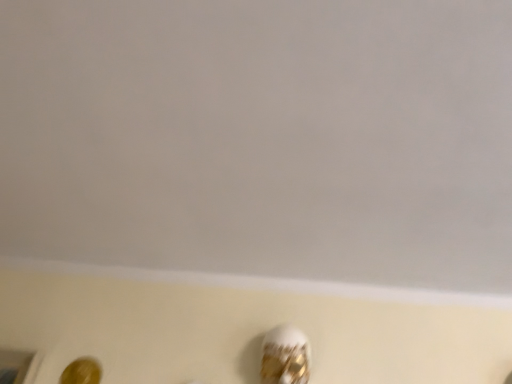
Where is `white glossy human face at lower center`? The height and width of the screenshot is (384, 512). white glossy human face at lower center is located at coordinates [x=284, y=364].

Measure the distance between point (307, 372) and camera.

They are 1.29 meters apart.

What do you see at coordinates (284, 364) in the screenshot? I see `white glossy human face at lower center` at bounding box center [284, 364].

Locate an element on the screen. The width and height of the screenshot is (512, 384). white glossy human face at lower center is located at coordinates (284, 364).